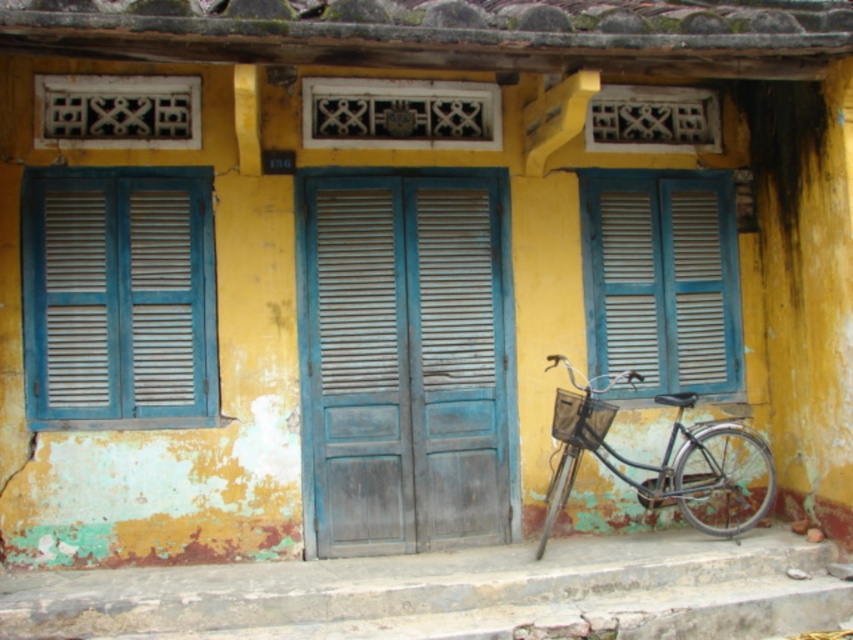
You are standing in front of the building and want to hang a small plant hanger between the blue wooden window at left and the blue wooden window at right. Which window should you place it closer to if you want the hanger to be centered between them?

You should place the plant hanger closer to the blue wooden window at right because the blue wooden window at left is to the left of the blue wooden window at right, so the center point would be closer to the right window.

You are standing in front of the building and want to enter through the double doors with blue shutters. To reach the doors, you need to navigate around the wooden at center and the concrete steps at lower center. Which object should you step over to get to the doors?

The wooden at center has a smaller size compared to concrete steps at lower center, so you should step over the wooden at center to reach the doors more easily.